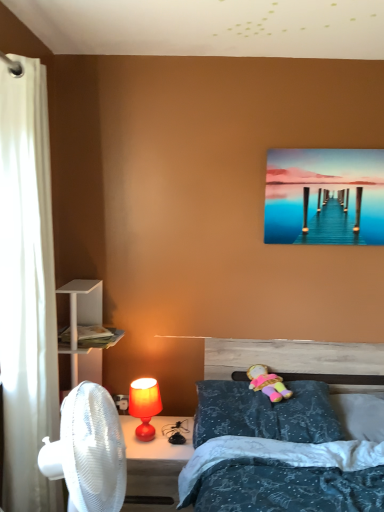
Identify the location of blank space situated above blue textured pillow at lower right, which appears as the second pillow when viewed from the left (from a real-world perspective). (365, 401).